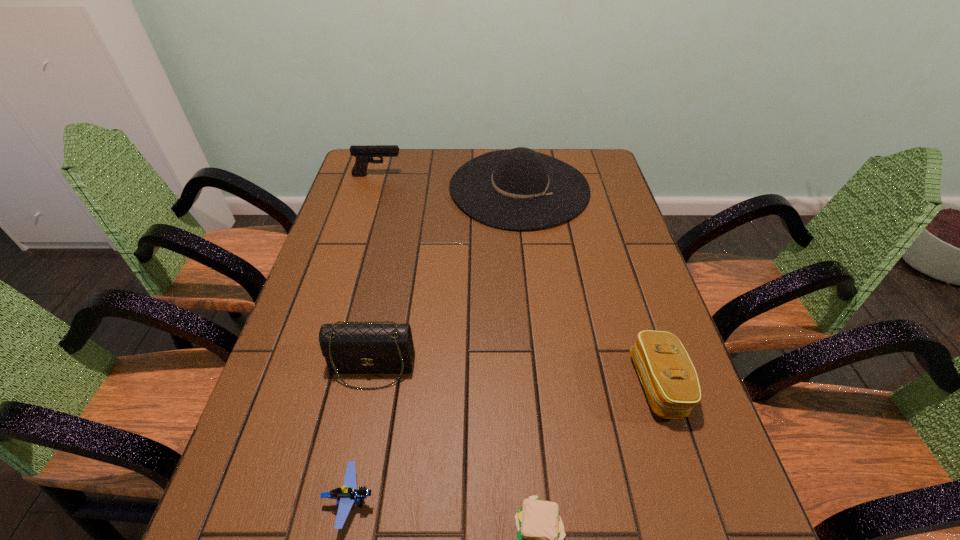
Locate an element on the screen. The width and height of the screenshot is (960, 540). free space located 0.320m on the zipper side of the fourth tallest object is located at coordinates (487, 384).

You are a GUI agent. You are given a task and a screenshot of the screen. Output one action in this format:
    pyautogui.click(x=<x>, y=<y>)
    Task: Click on the vacant area situated on the zipper side of the fourth tallest object
    Image resolution: width=960 pixels, height=540 pixels.
    Given the screenshot: What is the action you would take?
    pyautogui.click(x=450, y=384)

The height and width of the screenshot is (540, 960). In order to click on free space located 0.380m on the front-facing side of the fifth tallest object in this screenshot , I will do `click(587, 500)`.

At what (x,y) coordinates should I click in order to perform the action: click on sombrero positioned at the far edge. Please return your answer as a coordinate pair (x, y). Looking at the image, I should click on pos(516,189).

Locate an element on the screen. pistol that is at the far edge is located at coordinates (362, 153).

The width and height of the screenshot is (960, 540). What are the coordinates of `object that is at the near edge` in the screenshot? It's located at (348, 494).

Image resolution: width=960 pixels, height=540 pixels. I want to click on clutch bag positioned at the left edge, so click(348, 348).

Identify the location of pistol that is at the left edge. (362, 153).

You are a GUI agent. You are given a task and a screenshot of the screen. Output one action in this format:
    pyautogui.click(x=<x>, y=<y>)
    Task: Click on the sombrero that is at the right edge
    Image resolution: width=960 pixels, height=540 pixels.
    Given the screenshot: What is the action you would take?
    pyautogui.click(x=516, y=189)

I want to click on clutch bag present at the right edge, so click(668, 376).